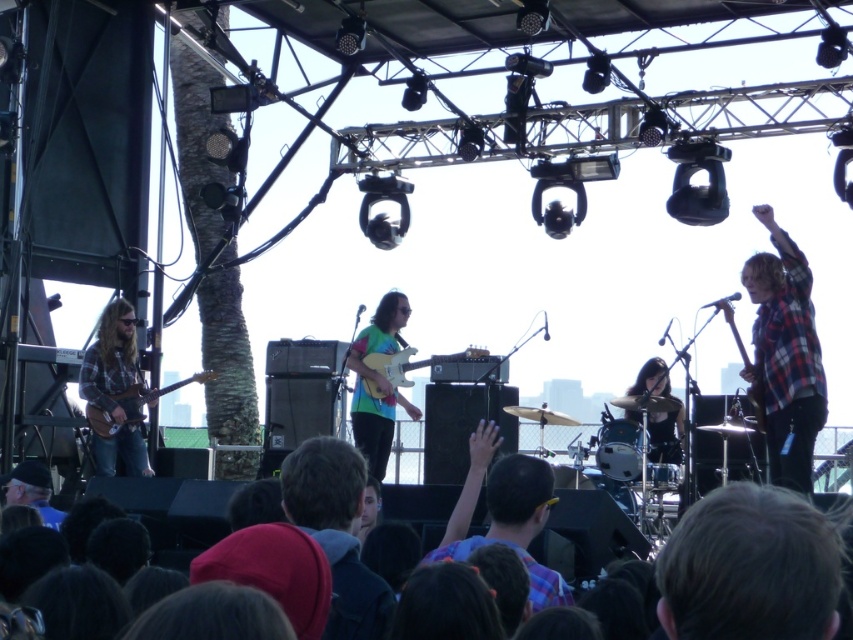
You are a photographer at the concert. You want to take a photo of the wooden electric guitar at left and the plaid flannel shirt at right. Can you see both objects in the same frame without moving your camera?

The plaid flannel shirt at right is in front of the wooden electric guitar at left, so the plaid flavel shirt at right may block the view of the wooden electric guitar at left. You might not be able to see both in the same frame without moving the camera.

You are a stagehand who needs to retrieve the plaid flannel shirt at right and the glossy wood electric guitar at center. Can you carry both items at the same time if your maximum carrying capacity is 100 pounds?

The plaid flannel shirt at right and the glossy wood electric guitar at center are 51.81 feet apart. Since the question is about carrying capacity, the distance between them is irrelevant. The answer cannot be determined with the given information.

You are a photographer at the concert and want to capture a photo of both the plaid fabric shirt at center and the wooden electric guitar at left. Which object is located to the right of the other?

The plaid fabric shirt at center is positioned on the right side of wooden electric guitar at left.